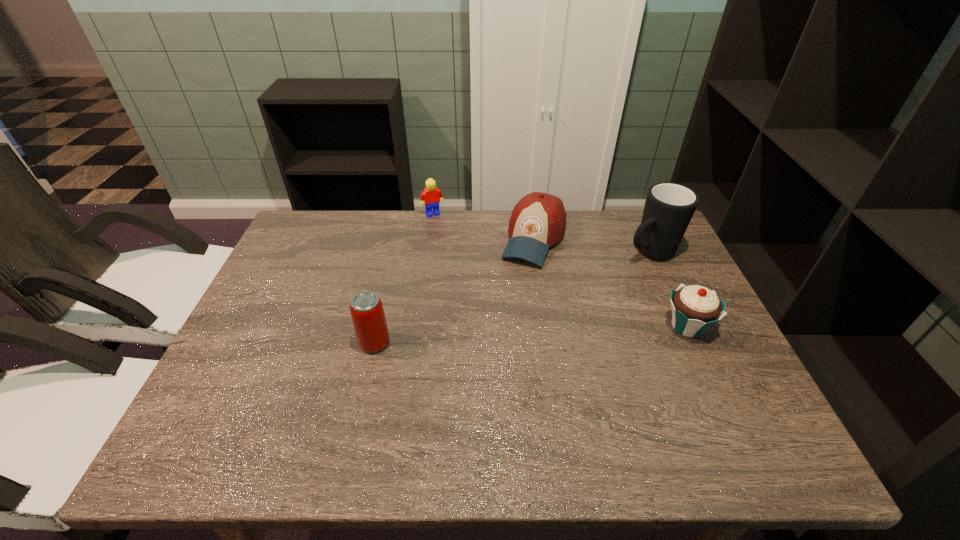
Find the location of a particular element. The width and height of the screenshot is (960, 540). vacant space that satisfies the following two spatial constraints: 1. on the back side of the Lego; 2. on the left side of the leftmost object is located at coordinates [x=404, y=214].

Where is `free spot that satisfies the following two spatial constraints: 1. on the back side of the beer can; 2. on the left side of the fourth object from right to left`? This screenshot has width=960, height=540. free spot that satisfies the following two spatial constraints: 1. on the back side of the beer can; 2. on the left side of the fourth object from right to left is located at coordinates (404, 214).

Identify the location of free space that satisfies the following two spatial constraints: 1. on the front side of the third object from right to left; 2. on the right side of the cupcake. (546, 327).